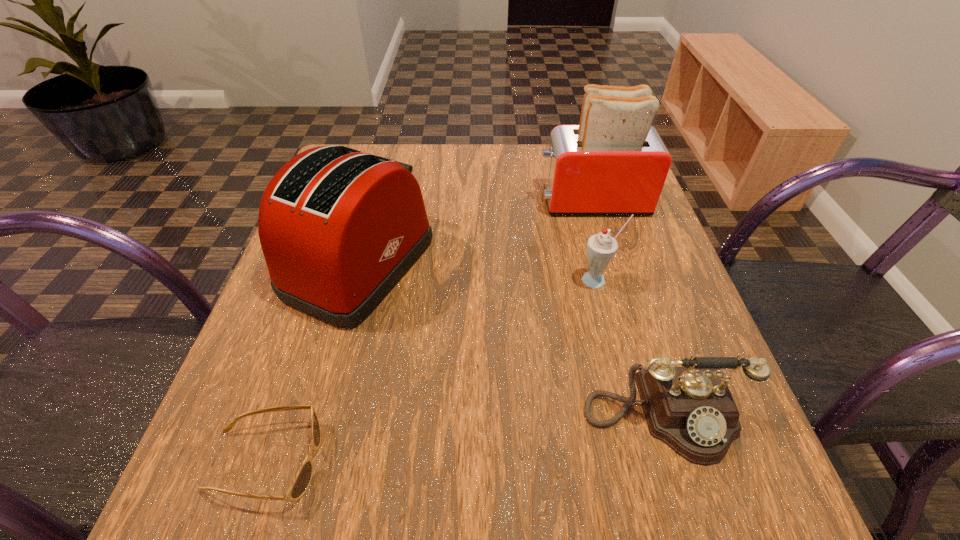
Identify the location of vacant space situated on the front-facing side of the sunglasses. (588, 461).

The image size is (960, 540). Find the location of `object that is at the far edge`. object that is at the far edge is located at coordinates (614, 162).

The height and width of the screenshot is (540, 960). Find the location of `telephone situated at the near edge`. telephone situated at the near edge is located at coordinates (690, 409).

This screenshot has height=540, width=960. Find the location of `sunglasses that is at the near edge`. sunglasses that is at the near edge is located at coordinates (301, 482).

The height and width of the screenshot is (540, 960). What are the coordinates of `toaster at the left edge` in the screenshot? It's located at (339, 228).

Identify the location of sunglasses located at the left edge. (301, 482).

Find the location of `toaster located in the right edge section of the desktop`. toaster located in the right edge section of the desktop is located at coordinates (614, 162).

At what (x,y) coordinates should I click in order to perform the action: click on milkshake that is at the right edge. Please return your answer as a coordinate pair (x, y). The width and height of the screenshot is (960, 540). Looking at the image, I should click on (601, 248).

In order to click on telephone located at the right edge in this screenshot , I will do [690, 409].

At what (x,y) coordinates should I click in order to perform the action: click on object that is positioned at the near left corner. Please return your answer as a coordinate pair (x, y). The image size is (960, 540). Looking at the image, I should click on (301, 482).